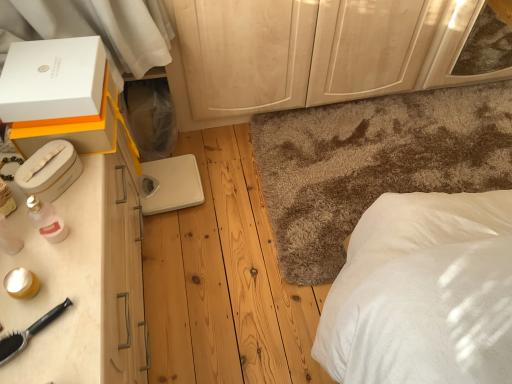
This screenshot has width=512, height=384. I want to click on vacant point to the right of white plastic scale at center, so click(226, 182).